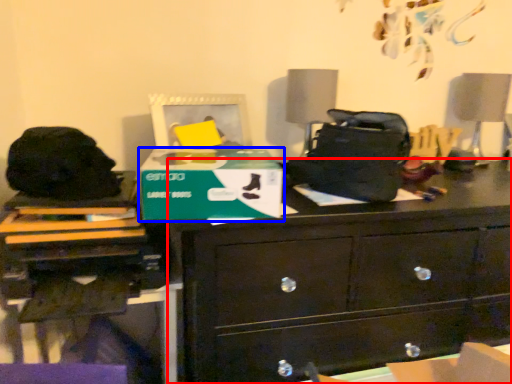
Question: Which object appears farthest to the camera in this image, chest of drawers (highlighted by a red box) or cardboard box (highlighted by a blue box)?

Choices:
 (A) chest of drawers
 (B) cardboard box

Answer: (A)